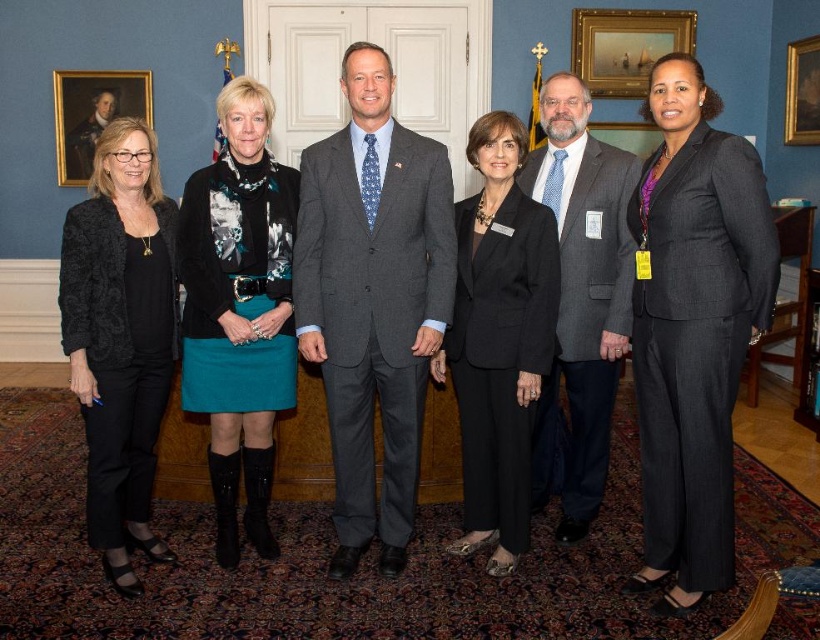
What is located at the coordinates point (372, 300)?

The gray suit at center is located at point (372, 300).

Looking at this image, you are standing at the point marked as point (697, 400). You want to walk to the white door in the center of the background. Is there enough space between the two people closest to your path to pass through?

The two people closest to your path are 8.13 feet apart, which is more than enough space for you to pass through comfortably.

In the scene shown: You are a photographer setting up a shoot in the room. You need to place a light source between the gray suit at center and the gray wool suit at center. Is this possible?

The gray suit at center is positioned under the gray wool suit at center, so placing a light source between them is not possible as they are vertically aligned rather than horizontally separated.